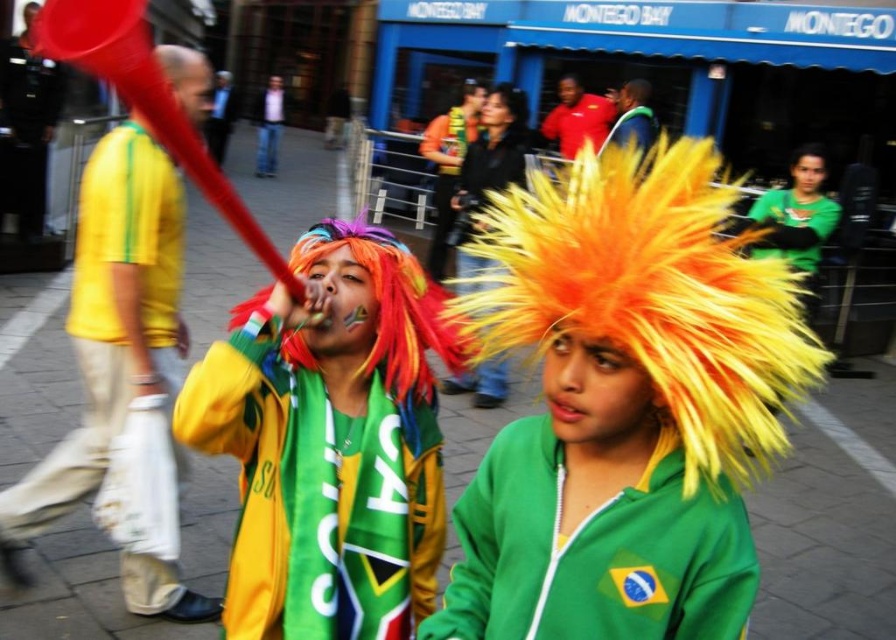
Question: Estimate the real-world distances between objects in this image. Which object is closer to the matte black camera at center?

Choices:
 (A) shiny black hair at center
 (B) multicolored wig at center
 (C) matte red shirt at center
 (D) green matte jacket at upper right

Answer: (A)

Question: Is the position of green matte jacket at upper right less distant than that of green jersey at center?

Choices:
 (A) yes
 (B) no

Answer: (A)

Question: Which is nearer to the green fabric jacket at center?

Choices:
 (A) green jersey at center
 (B) yellow matte shirt at left
 (C) shiny black hair at center
 (D) green matte jacket at upper right

Answer: (B)

Question: Among these objects, which one is nearest to the camera?

Choices:
 (A) shiny black hair at center
 (B) green matte jacket at upper right
 (C) fluffy yellow-orange wig at center
 (D) green jersey at center

Answer: (C)

Question: In this image, where is multicolored wig at center located relative to green fabric jacket at center?

Choices:
 (A) right
 (B) left

Answer: (B)

Question: Does shiny black hair at center have a larger size compared to matte red shirt at center?

Choices:
 (A) no
 (B) yes

Answer: (A)